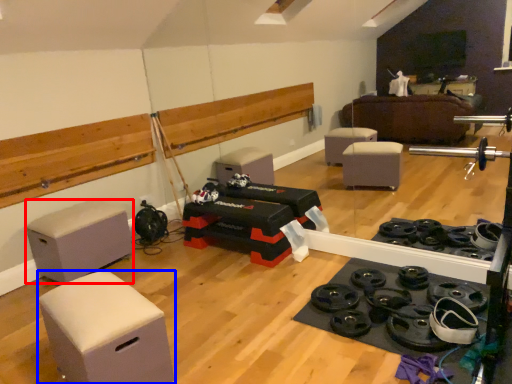
Question: Which object appears closest to the camera in this image, furniture (highlighted by a red box) or furniture (highlighted by a blue box)?

Choices:
 (A) furniture
 (B) furniture

Answer: (B)